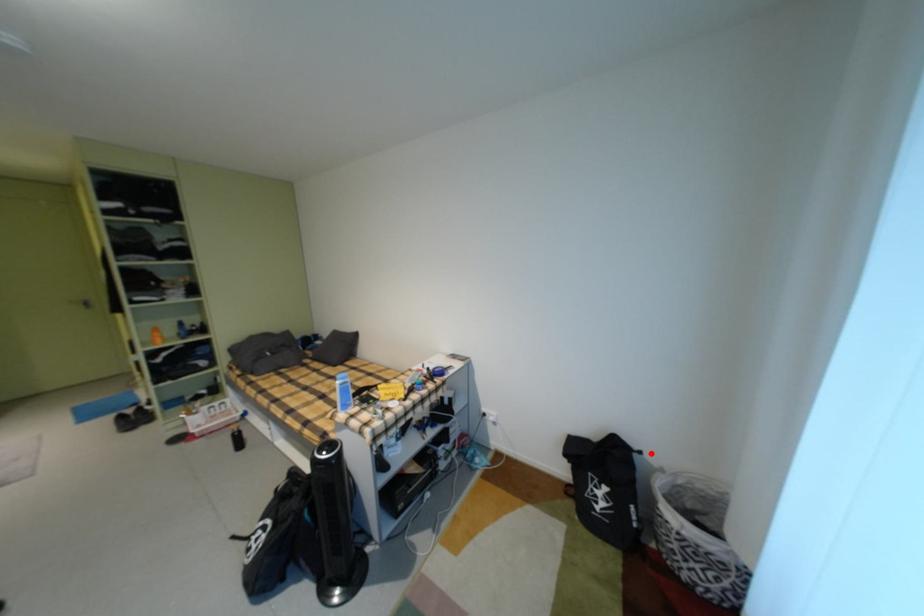
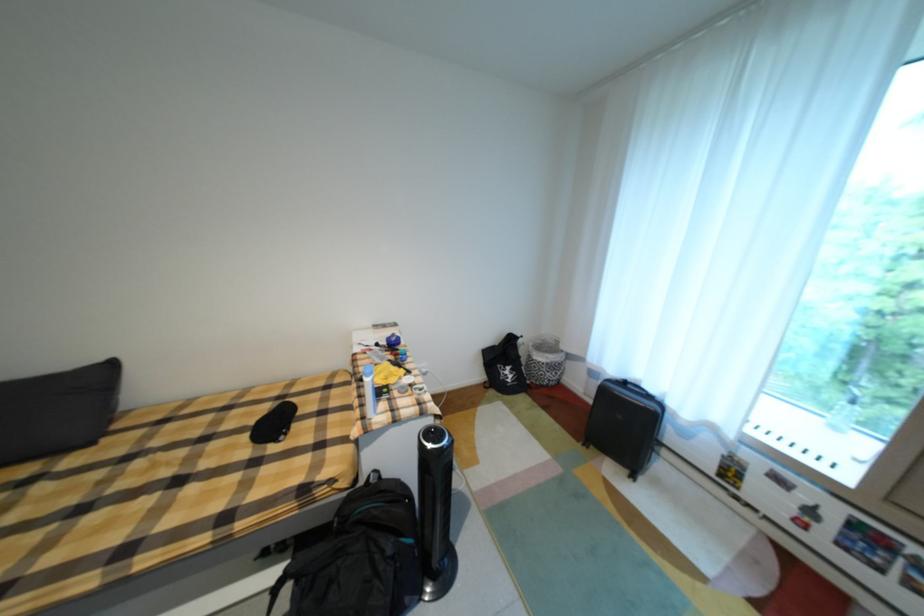
Locate, in the second image, the point that corresponds to the highlighted location in the first image.

(531, 338)